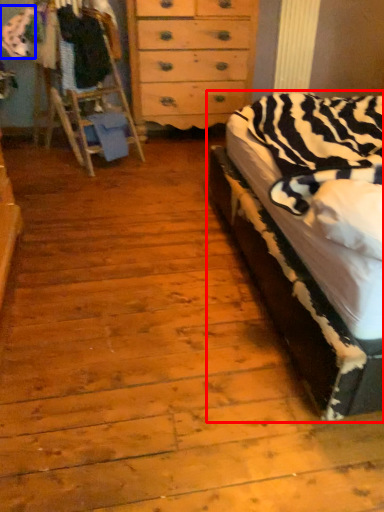
Question: Which object appears farthest to the camera in this image, bed (highlighted by a red box) or clothing (highlighted by a blue box)?

Choices:
 (A) bed
 (B) clothing

Answer: (B)